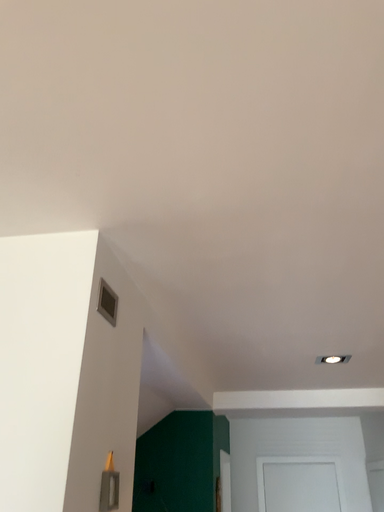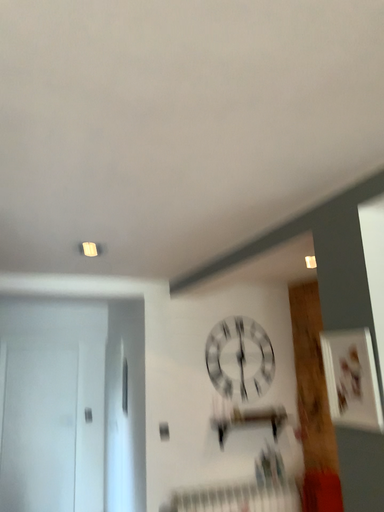
Question: Which way did the camera rotate in the video?

Choices:
 (A) rotated upward
 (B) rotated downward

Answer: (B)